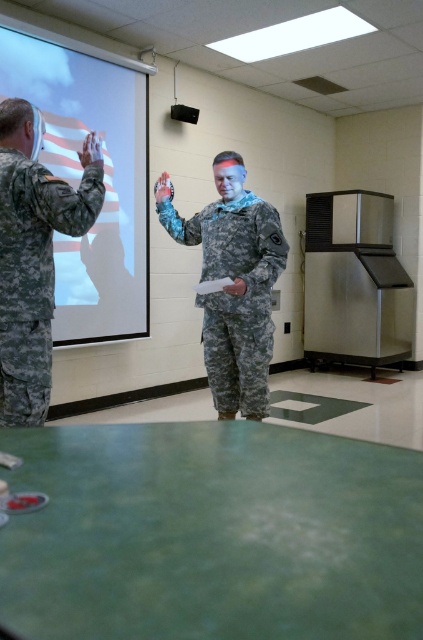
You are an attendee at a military briefing. You need to present a large map on the white matte projection screen at upper left and also have your camouflage fabric uniform at left visible to the audience. Since the screen is bigger than the uniform, will the map cover the uniform when displayed?

The white matte projection screen at upper left is bigger than the camouflage fabric uniform at left, so when the map is displayed on the screen, it will cover the uniform because the screen is larger in size.